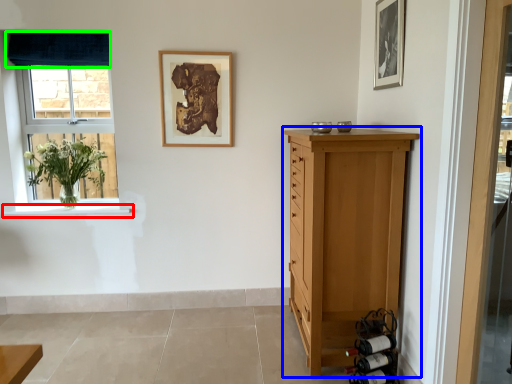
Question: Which is nearer to the window sill (highlighted by a red box)? chest of drawers (highlighted by a blue box) or curtain (highlighted by a green box).

Choices:
 (A) chest of drawers
 (B) curtain

Answer: (B)